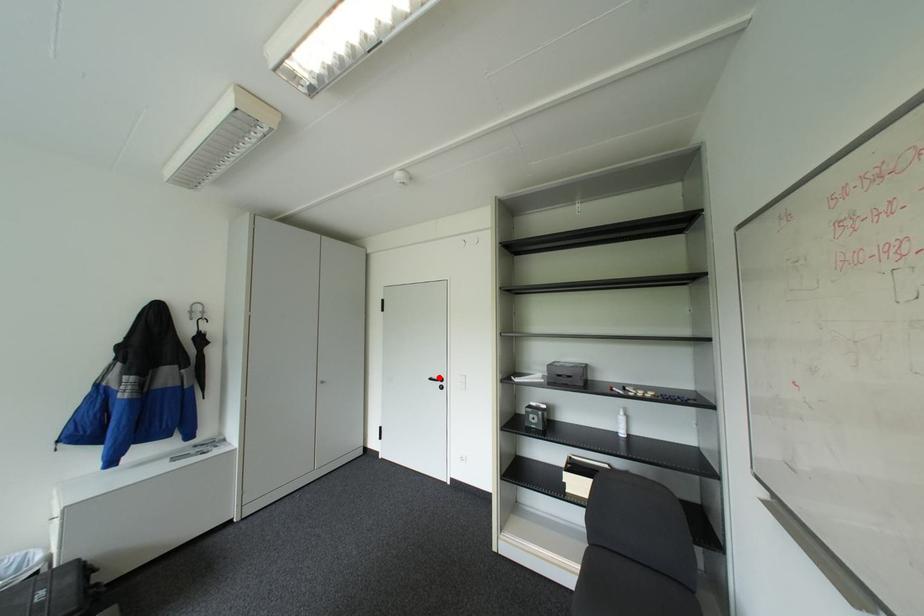
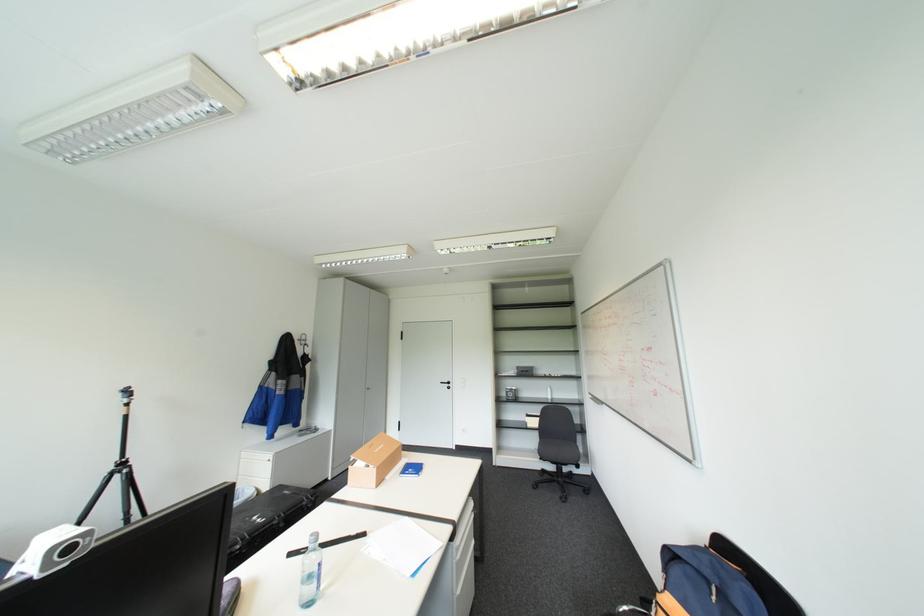
The point at the highlighted location is marked in the first image. Where is the corresponding point in the second image?

(450, 381)